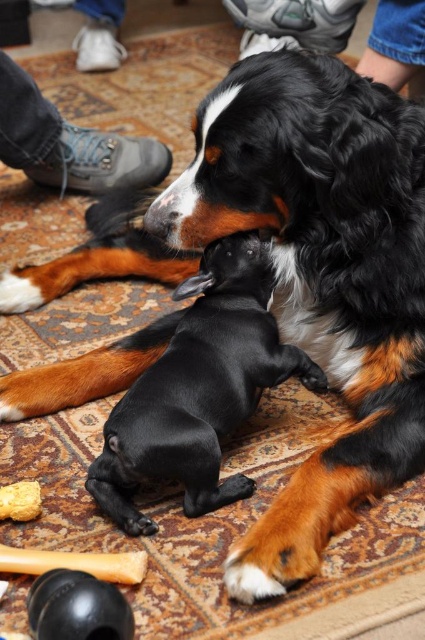
Question: In this image, where is leather shoe at upper left located relative to jeans at upper center?

Choices:
 (A) below
 (B) above

Answer: (A)

Question: Among these points, which one is nearest to the camera?

Choices:
 (A) (2, 492)
 (B) (235, 13)

Answer: (A)

Question: Which object is positioned closest to the jeans at upper center?

Choices:
 (A) smooth yellow rubber toy at lower left
 (B) leather shoe at upper left
 (C) black rubber ball at lower left
 (D) black smooth puppy at center

Answer: (B)

Question: Considering the relative positions of black smooth puppy at center and smooth yellow rubber toy at lower left in the image provided, where is black smooth puppy at center located with respect to smooth yellow rubber toy at lower left?

Choices:
 (A) right
 (B) left

Answer: (A)

Question: Can you confirm if black smooth puppy at center is thinner than leather shoe at upper left?

Choices:
 (A) yes
 (B) no

Answer: (A)

Question: Which point is closer to the camera taking this photo?

Choices:
 (A) (181, 445)
 (B) (19, 516)
 (C) (166, 150)

Answer: (A)